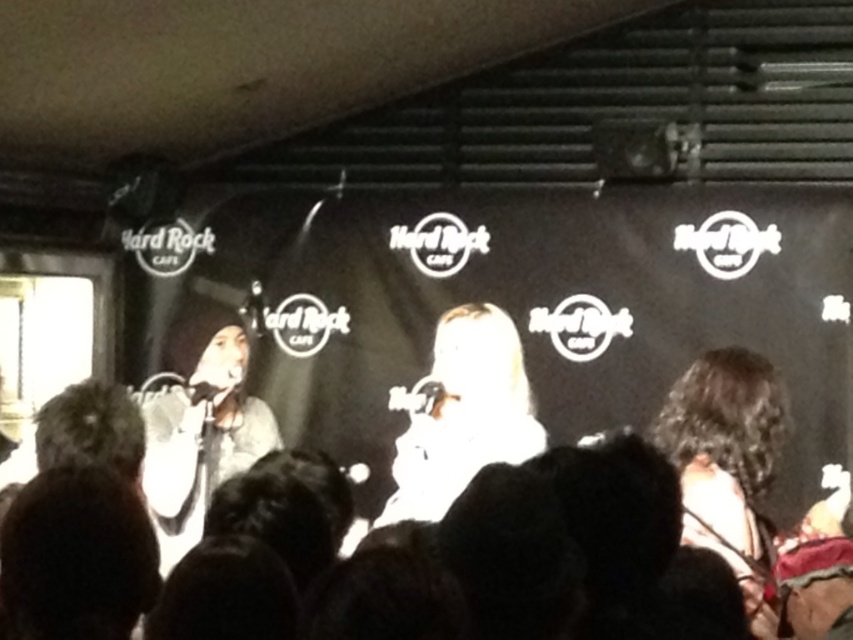
Question: Which of these objects is positioned farthest from the matte black microphone at left?

Choices:
 (A) curly hair at right
 (B) white matte microphone at center

Answer: (A)

Question: Does white matte microphone at center have a lesser width compared to matte black microphone at left?

Choices:
 (A) yes
 (B) no

Answer: (B)

Question: Estimate the real-world distances between objects in this image. Which object is closer to the curly hair at right?

Choices:
 (A) matte black microphone at left
 (B) white matte microphone at center

Answer: (B)

Question: Is white matte microphone at center positioned at the back of matte black microphone at left?

Choices:
 (A) yes
 (B) no

Answer: (B)

Question: Which object is farther from the camera taking this photo?

Choices:
 (A) white matte microphone at center
 (B) curly hair at right
 (C) matte black microphone at left

Answer: (C)

Question: Is curly hair at right in front of white matte microphone at center?

Choices:
 (A) yes
 (B) no

Answer: (A)